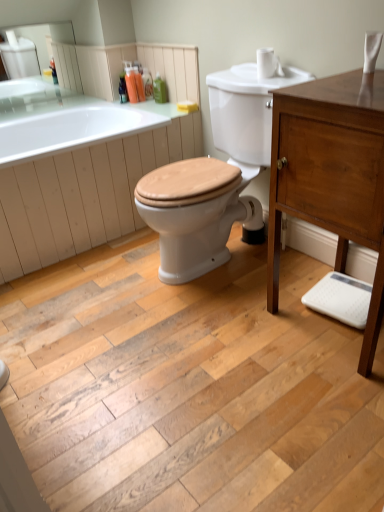
I want to click on free space in front of white glossy toilet at center, so click(211, 336).